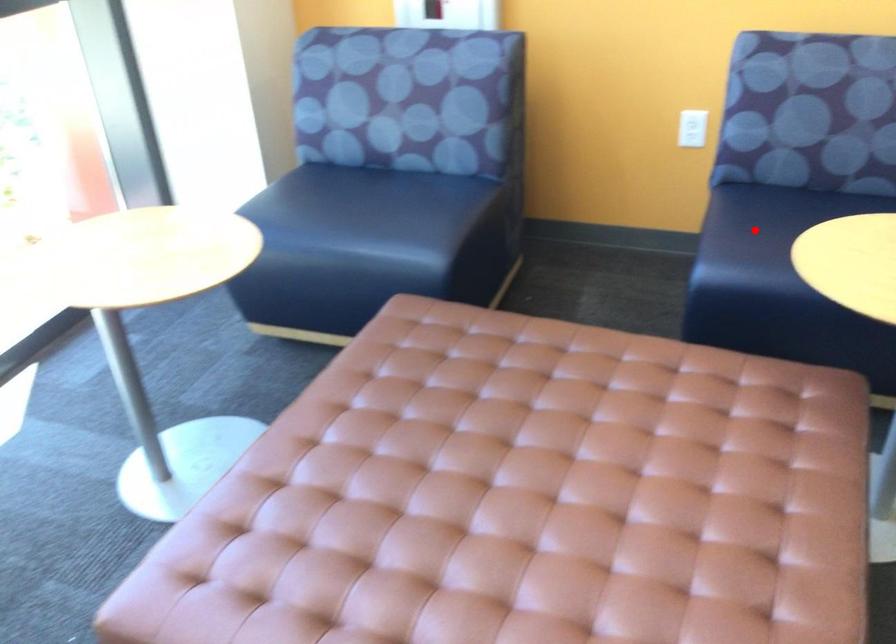
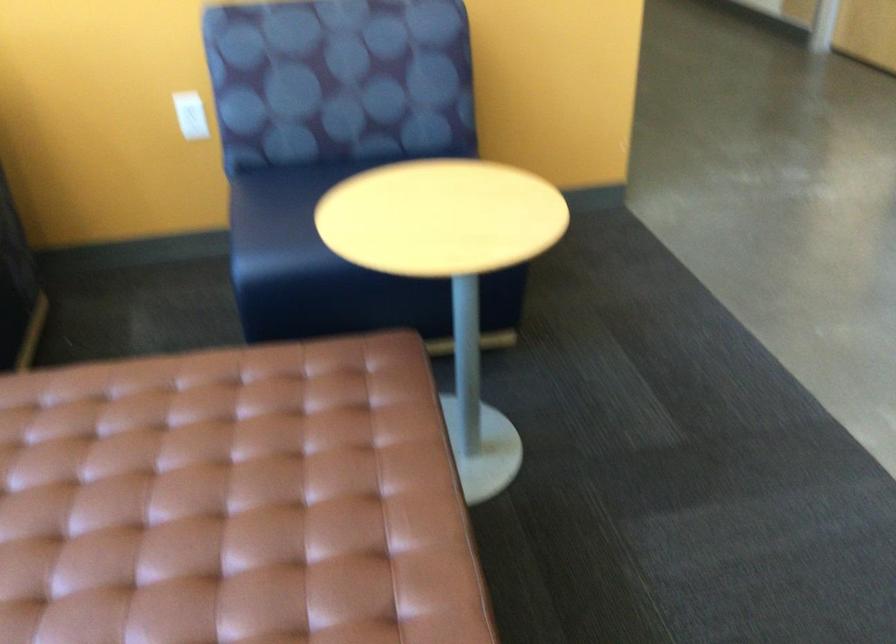
Where in the second image is the point corresponding to the highlighted location from the first image?

(282, 210)